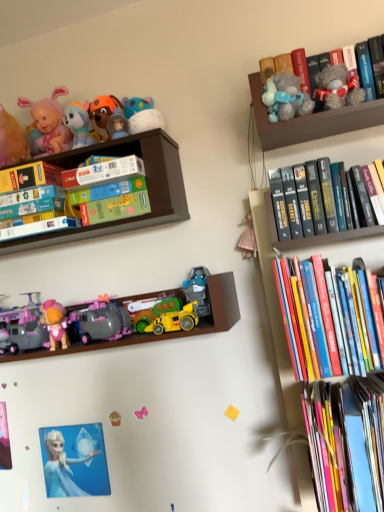
Question: From a real-world perspective, is yellow plastic toy car at center under hardcover book at left, the 2th paperback book when ordered from right to left?

Choices:
 (A) yes
 (B) no

Answer: (A)

Question: From the image's perspective, is yellow plastic toy car at center on hardcover book at left, the 2th paperback book when ordered from right to left?

Choices:
 (A) no
 (B) yes

Answer: (A)

Question: Is yellow plastic toy car at center closer to the viewer compared to hardcover book at left, positioned as the 2th paperback book in top-to-bottom order?

Choices:
 (A) yes
 (B) no

Answer: (A)

Question: Are yellow plastic toy car at center and hardcover book at left, positioned as the 2th paperback book in top-to-bottom order, beside each other?

Choices:
 (A) yes
 (B) no

Answer: (B)

Question: Is yellow plastic toy car at center not near hardcover book at left, which ranks as the first paperback book in bottom-to-top order?

Choices:
 (A) yes
 (B) no

Answer: (B)

Question: Is yellow plastic toy car at center at the left side of hardcover book at left, the first paperback book from the left?

Choices:
 (A) yes
 (B) no

Answer: (B)

Question: From a real-world perspective, is plush toy at upper left, which is counted as the fifth toy, starting from the bottom, on hardcover book at left, positioned as the 2th paperback book in top-to-bottom order?

Choices:
 (A) no
 (B) yes

Answer: (B)

Question: From the image's perspective, does plush toy at upper left, which is counted as the fifth toy, starting from the bottom, appear lower than hardcover book at left, which ranks as the first paperback book in bottom-to-top order?

Choices:
 (A) yes
 (B) no

Answer: (B)

Question: Is hardcover book at left, the 2th paperback book when ordered from right to left, at the back of plush toy at upper left, which is the third toy from top to bottom?

Choices:
 (A) yes
 (B) no

Answer: (B)

Question: Can you confirm if plush toy at upper left, which is the third toy from top to bottom, is shorter than hardcover book at left, the first paperback book from the left?

Choices:
 (A) no
 (B) yes

Answer: (A)

Question: Is plush toy at upper left, which is the sixth toy from right to left, positioned far away from hardcover book at left, which ranks as the first paperback book in bottom-to-top order?

Choices:
 (A) no
 (B) yes

Answer: (A)

Question: Is plush toy at upper left, which is counted as the fifth toy, starting from the bottom, at the right side of hardcover book at left, the 2th paperback book when ordered from right to left?

Choices:
 (A) no
 (B) yes

Answer: (B)

Question: Would you say wooden toy box at upper left, acting as the first shelf starting from the top, is a long distance from fluffy gray teddy bear at upper right, acting as the second toy starting from the right?

Choices:
 (A) yes
 (B) no

Answer: (B)